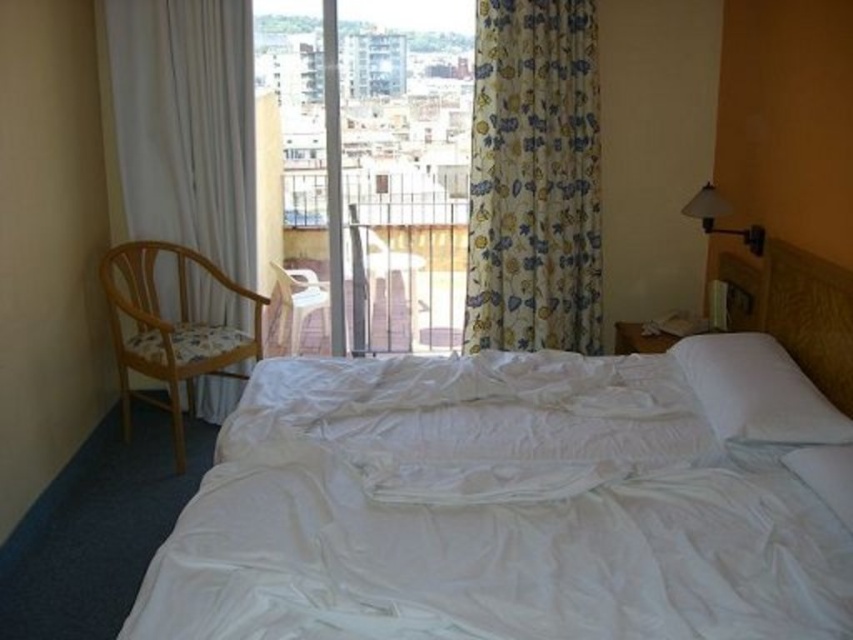
You are a delivery person who needs to place a large package between the white soft bed at center and the white plastic armchair at center. The package is 6 feet long. Will there be enough space to fit it between them?

The distance between the white soft bed at center and the white plastic armchair at center is 5.65 feet, which is shorter than the package length of 6 feet. Therefore, the package cannot fit between them.

You are trying to move a large rectangular box from the door to the closet in this bedroom. The path between the white soft bed at center and the white plastic armchair at center is narrow. Do you think the box will fit through this path?

The path between the white soft bed at center and the white plastic armchair at center is narrow. Since the box is large and rectangular, it might not fit through the narrow path between the white soft bed at center and the white plastic armchair at center.